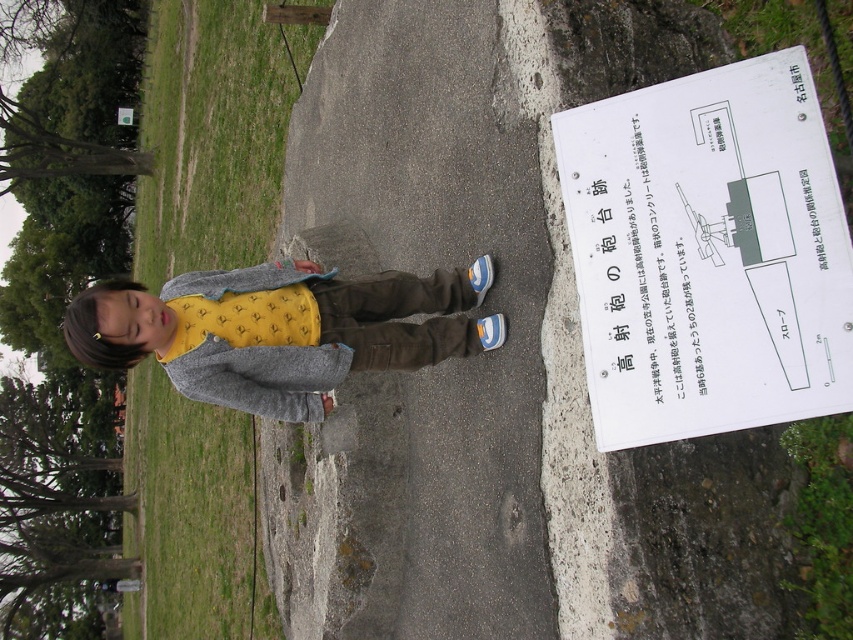
You are a delivery drone trying to land on the gray concrete pavement at center. The landing coordinates are given as point (x=433, y=368). Is this point on the gray concrete pavement at center?

Yes, the point (x=433, y=368) corresponds to the gray concrete pavement at center, so the drone can land there.

You are a tourist visiting the historical site and want to read the signboard. The signboard is located at point [708,253]. However, you notice a white paper sign at right near that point. Where exactly is the white paper sign located relative to the signboard?

The white paper sign at right is located at point [708,253].